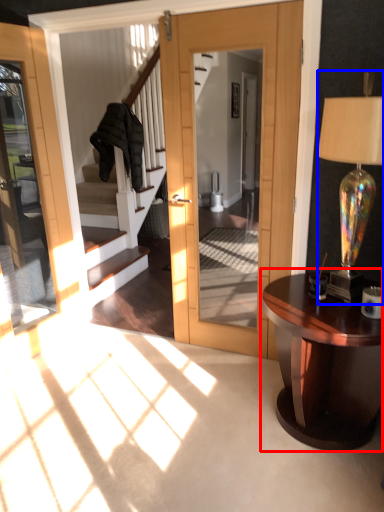
Question: Which point is further to the camera, table (highlighted by a red box) or lamp (highlighted by a blue box)?

Choices:
 (A) table
 (B) lamp

Answer: (A)